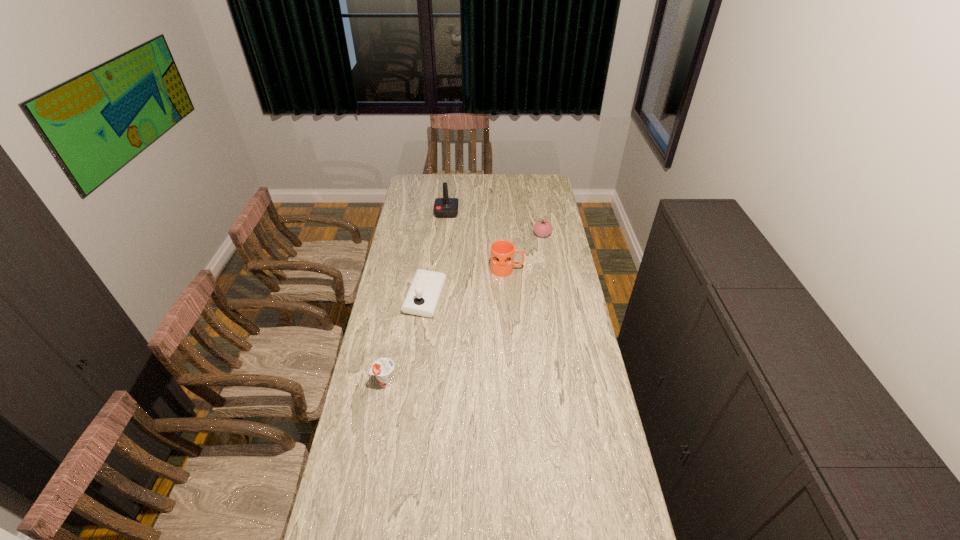
At what (x,y) coordinates should I click in order to perform the action: click on vacant space located 0.150m on the handle side of the third nearest object. Please return your answer as a coordinate pair (x, y). The image size is (960, 540). Looking at the image, I should click on (555, 269).

This screenshot has height=540, width=960. I want to click on free space located on the left of the shorter joystick, so click(383, 298).

Where is `free space located 0.360m on the left of the second farthest object`? free space located 0.360m on the left of the second farthest object is located at coordinates (466, 234).

Locate an element on the screen. This screenshot has height=540, width=960. vacant region located 0.400m on the right of the nearest object is located at coordinates (503, 381).

The image size is (960, 540). Find the location of `joystick located in the left edge section of the desktop`. joystick located in the left edge section of the desktop is located at coordinates (422, 298).

Where is `yogurt present at the left edge`? yogurt present at the left edge is located at coordinates (383, 368).

Where is `object that is positioned at the right edge`? This screenshot has height=540, width=960. object that is positioned at the right edge is located at coordinates (542, 228).

Where is `free space at the far edge`? This screenshot has height=540, width=960. free space at the far edge is located at coordinates (470, 178).

This screenshot has height=540, width=960. In the image, there is a desktop. Find the location of `blank space at the left edge`. blank space at the left edge is located at coordinates (408, 229).

Locate an element on the screen. Image resolution: width=960 pixels, height=540 pixels. vacant area at the right edge of the desktop is located at coordinates (559, 287).